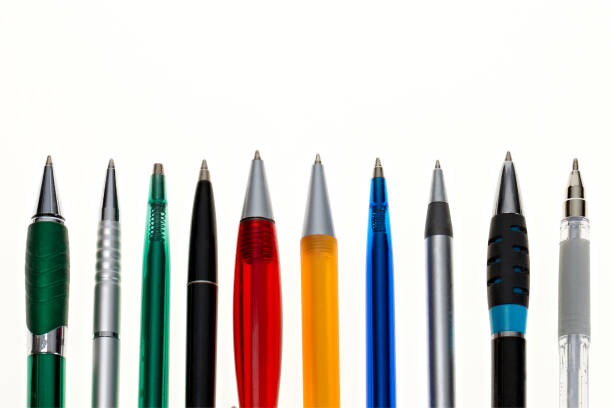
Identify the location of pens. (43, 291), (102, 289), (155, 288), (204, 289), (253, 290), (327, 294), (371, 294), (436, 301), (510, 302), (577, 311).